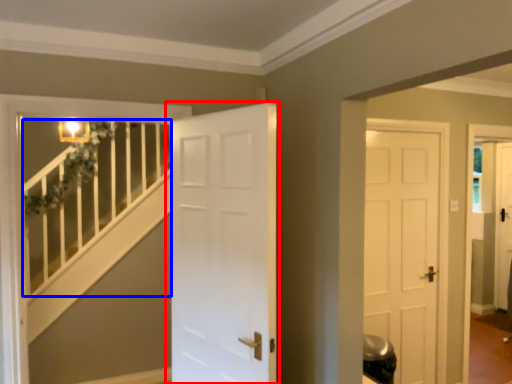
Question: Among these objects, which one is nearest to the camera, door (highlighted by a red box) or balustrade (highlighted by a blue box)?

Choices:
 (A) door
 (B) balustrade

Answer: (A)